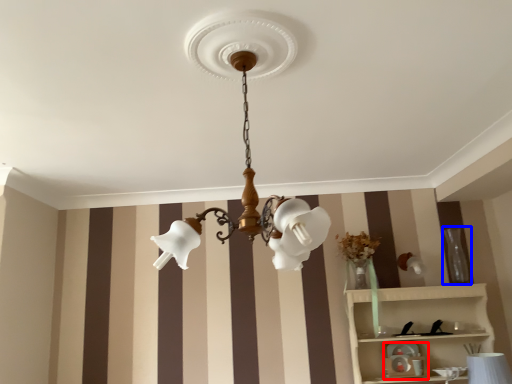
Question: Which object appears farthest to the camera in this image, toy (highlighted by a red box) or vase (highlighted by a blue box)?

Choices:
 (A) toy
 (B) vase

Answer: (B)